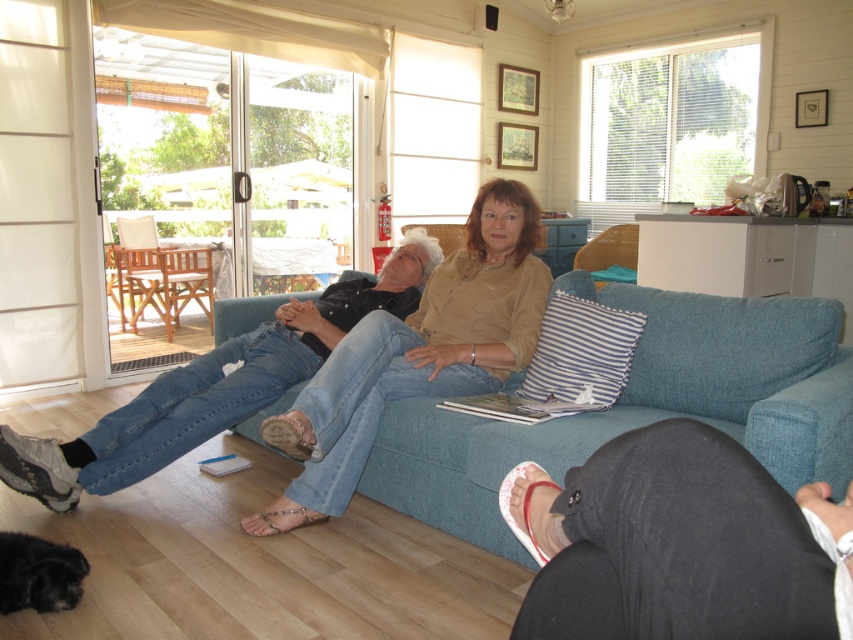
Who is positioned more to the left, blue fabric couch at center or denim jeans at center?

denim jeans at center is more to the left.

Does point (500, 477) come behind point (502, 310)?

No, (500, 477) is in front of (502, 310).

Where is `blue fabric couch at center`? The width and height of the screenshot is (853, 640). blue fabric couch at center is located at coordinates (639, 406).

Does blue fabric couch at center come in front of black fabric pants at lower right?

No, it is not.

Is point (701, 346) in front of point (624, 534)?

No, (701, 346) is behind (624, 534).

Does point (424, 403) lie in front of point (743, 458)?

No, (424, 403) is behind (743, 458).

The height and width of the screenshot is (640, 853). I want to click on blue fabric couch at center, so click(639, 406).

The width and height of the screenshot is (853, 640). What do you see at coordinates (682, 545) in the screenshot?
I see `black fabric pants at lower right` at bounding box center [682, 545].

Is black fabric pants at lower right shorter than denim jeans at center?

Yes.

Who is more distant from viewer, (821,522) or (489,349)?

The point (489,349) is more distant.

Image resolution: width=853 pixels, height=640 pixels. Find the location of `black fabric pants at lower right`. black fabric pants at lower right is located at coordinates (682, 545).